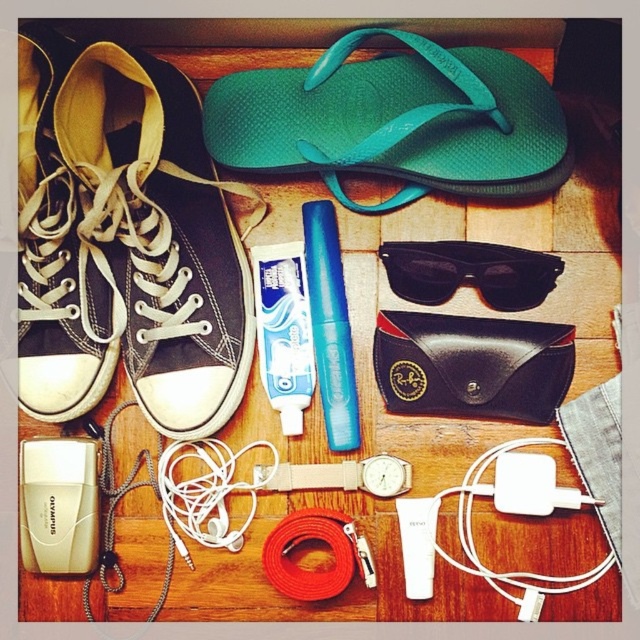
What object is located at the coordinates point (396,122)?

The point (396,122) marks the teal rubber flip flop at upper center.